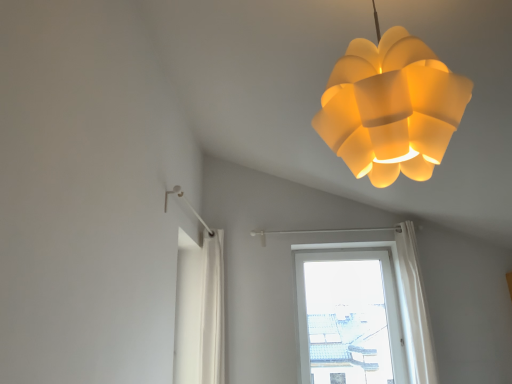
Question: Should I look upward or downward to see transparent glass window at center?

Choices:
 (A) up
 (B) down

Answer: (B)

Question: From a real-world perspective, is matte yellow plastic lamp at upper center over transparent glass window at center?

Choices:
 (A) no
 (B) yes

Answer: (B)

Question: Would you say matte yellow plastic lamp at upper center contains transparent glass window at center?

Choices:
 (A) yes
 (B) no

Answer: (B)

Question: Is matte yellow plastic lamp at upper center aimed at transparent glass window at center?

Choices:
 (A) no
 (B) yes

Answer: (A)

Question: Is the position of matte yellow plastic lamp at upper center less distant than that of transparent glass window at center?

Choices:
 (A) yes
 (B) no

Answer: (A)

Question: Is matte yellow plastic lamp at upper center positioned beyond the bounds of transparent glass window at center?

Choices:
 (A) yes
 (B) no

Answer: (A)

Question: Is matte yellow plastic lamp at upper center to the left of transparent glass window at center from the viewer's perspective?

Choices:
 (A) yes
 (B) no

Answer: (A)

Question: Is transparent glass window at center aimed at matte yellow plastic lamp at upper center?

Choices:
 (A) no
 (B) yes

Answer: (B)

Question: Are transparent glass window at center and matte yellow plastic lamp at upper center making contact?

Choices:
 (A) no
 (B) yes

Answer: (A)

Question: Does transparent glass window at center have a larger size compared to matte yellow plastic lamp at upper center?

Choices:
 (A) no
 (B) yes

Answer: (A)

Question: Is transparent glass window at center shorter than matte yellow plastic lamp at upper center?

Choices:
 (A) yes
 (B) no

Answer: (B)

Question: Is transparent glass window at center taller than matte yellow plastic lamp at upper center?

Choices:
 (A) yes
 (B) no

Answer: (A)

Question: Is the depth of transparent glass window at center greater than that of matte yellow plastic lamp at upper center?

Choices:
 (A) no
 (B) yes

Answer: (B)

Question: From a real-world perspective, is transparent glass window at center above or below matte yellow plastic lamp at upper center?

Choices:
 (A) below
 (B) above

Answer: (A)